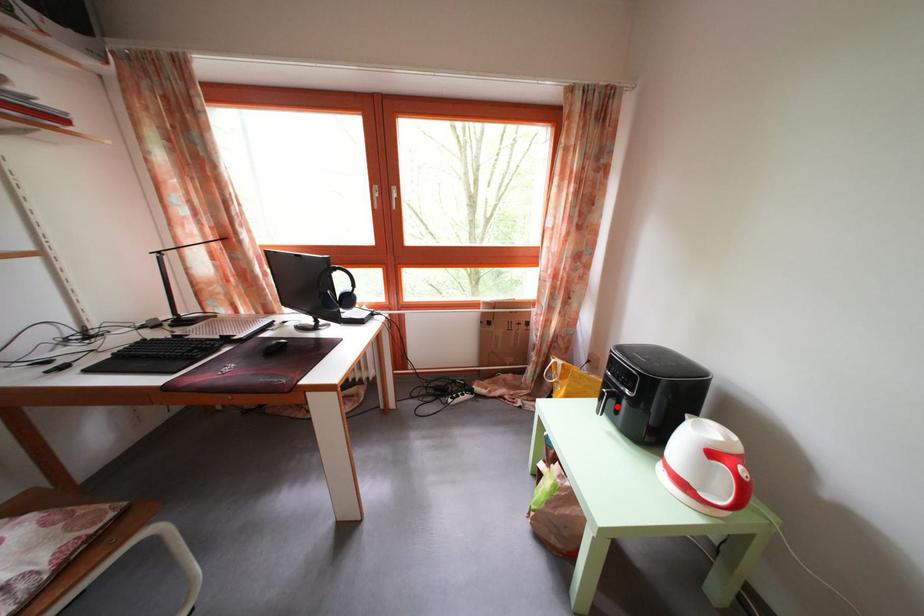
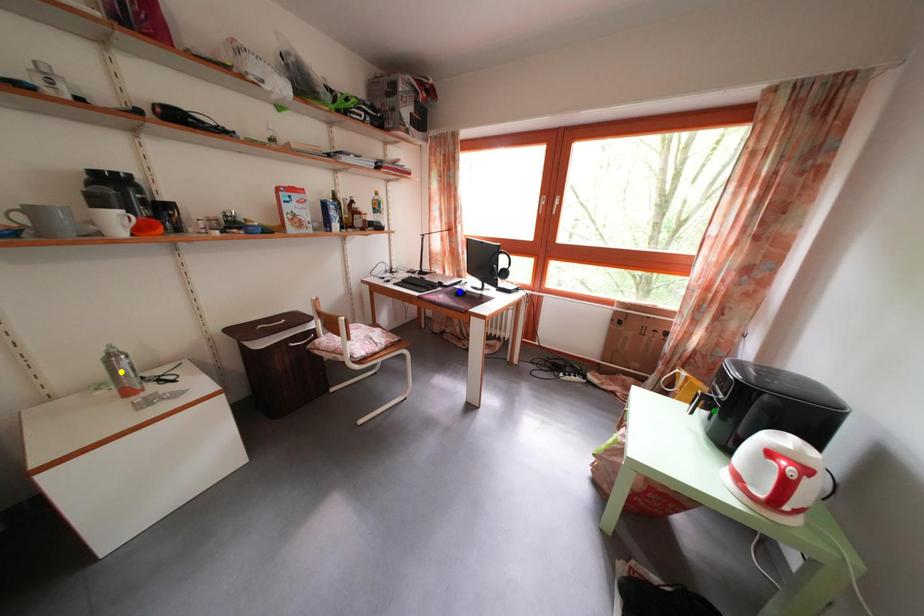
Question: I am providing you with two images of the same scene from different viewpoints. A red point is marked on the first image. You are given multiple points on the second image. Can you choose the point in image 2 that corresponds to the point in image 1?

Choices:
 (A) yellow point
 (B) blue point
 (C) green point

Answer: (C)